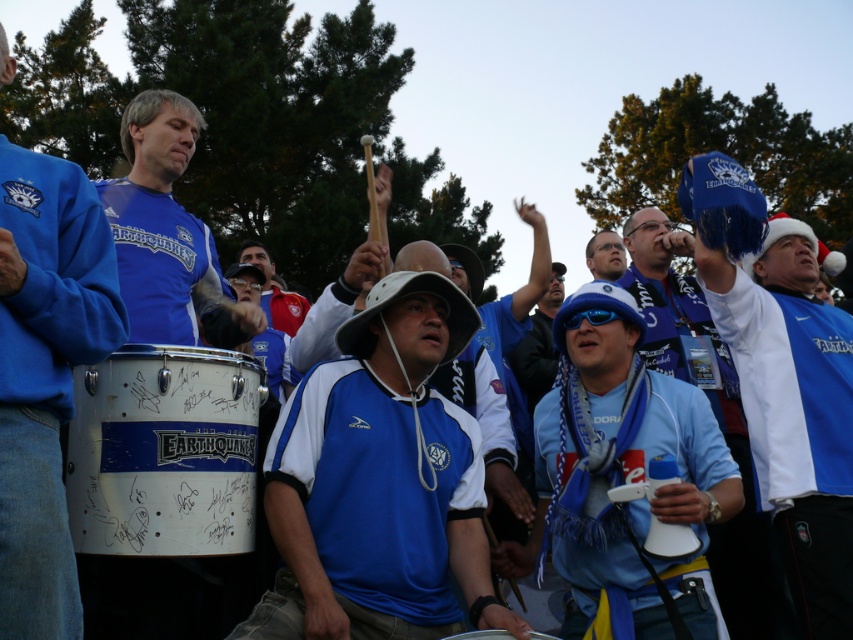
Who is positioned more to the right, matte blue sweatshirt at left or matte blue jersey at center?

From the viewer's perspective, matte blue jersey at center appears more on the right side.

Does matte blue sweatshirt at left have a smaller size compared to matte blue jersey at center?

Incorrect, matte blue sweatshirt at left is not smaller in size than matte blue jersey at center.

Which is in front, point (22, 596) or point (192, 320)?

Point (22, 596) is in front.

Where is `matte blue sweatshirt at left`? This screenshot has height=640, width=853. matte blue sweatshirt at left is located at coordinates (45, 374).

Is matte blue sweatshirt at left shorter than white metallic drum at center?

No, matte blue sweatshirt at left is not shorter than white metallic drum at center.

Between matte blue sweatshirt at left and white metallic drum at center, which one appears on the right side from the viewer's perspective?

From the viewer's perspective, white metallic drum at center appears more on the right side.

Locate an element on the screen. The image size is (853, 640). matte blue sweatshirt at left is located at coordinates (45, 374).

Can you confirm if blue fabric scarf at center is positioned above matte blue sweatshirt at left?

No, blue fabric scarf at center is not above matte blue sweatshirt at left.

Who is lower down, blue fabric scarf at center or matte blue sweatshirt at left?

blue fabric scarf at center is lower down.

Find the location of `blue fabric scarf at center`. blue fabric scarf at center is located at coordinates (619, 464).